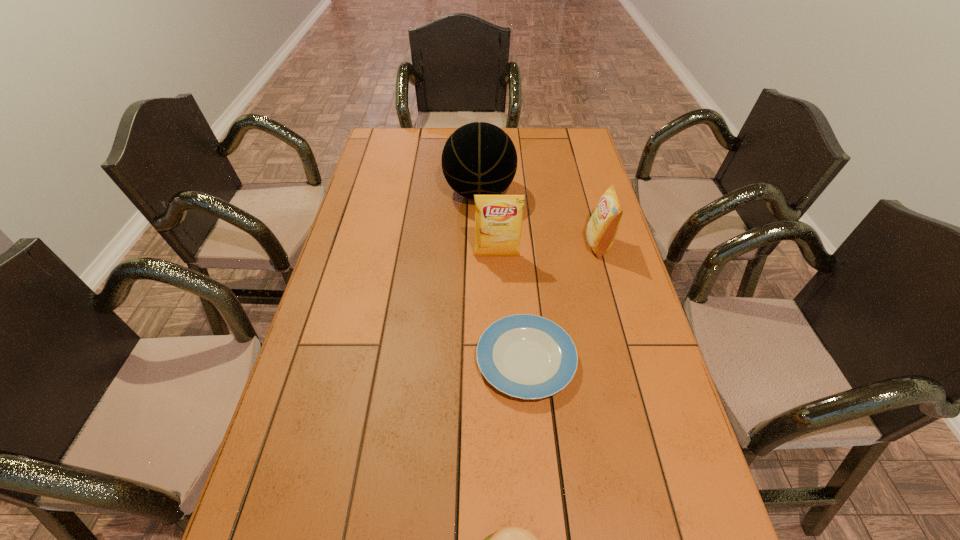
Identify the location of free location located 0.350m on the front-facing side of the third shortest object. (476, 245).

At what (x,y) coordinates should I click in order to perform the action: click on free space located 0.220m on the front of the second nearest object. Please return your answer as a coordinate pair (x, y). Looking at the image, I should click on (539, 509).

At what (x,y) coordinates should I click in order to perform the action: click on object positioned at the right edge. Please return your answer as a coordinate pair (x, y). The image size is (960, 540). Looking at the image, I should click on (601, 229).

Locate an element on the screen. Image resolution: width=960 pixels, height=540 pixels. vacant position at the left edge of the desktop is located at coordinates (364, 166).

You are a GUI agent. You are given a task and a screenshot of the screen. Output one action in this format:
    pyautogui.click(x=<x>, y=<y>)
    Task: Click on the vacant space at the right edge
    The height and width of the screenshot is (540, 960).
    Given the screenshot: What is the action you would take?
    pyautogui.click(x=649, y=514)

Where is `free location at the far left corner of the desktop`? free location at the far left corner of the desktop is located at coordinates (390, 133).

At what (x,y) coordinates should I click in order to perform the action: click on vacant space at the far right corner of the desktop. Please return your answer as a coordinate pair (x, y). Looking at the image, I should click on click(590, 151).

Where is `free spot between the plate and the farthest object`? This screenshot has height=540, width=960. free spot between the plate and the farthest object is located at coordinates (x=503, y=276).

This screenshot has height=540, width=960. I want to click on empty space between the rightmost object and the basketball, so click(x=539, y=219).

At what (x,y) coordinates should I click in order to perform the action: click on free space between the rightmost object and the shortest object. Please return your answer as a coordinate pair (x, y). This screenshot has height=540, width=960. Looking at the image, I should click on (563, 302).